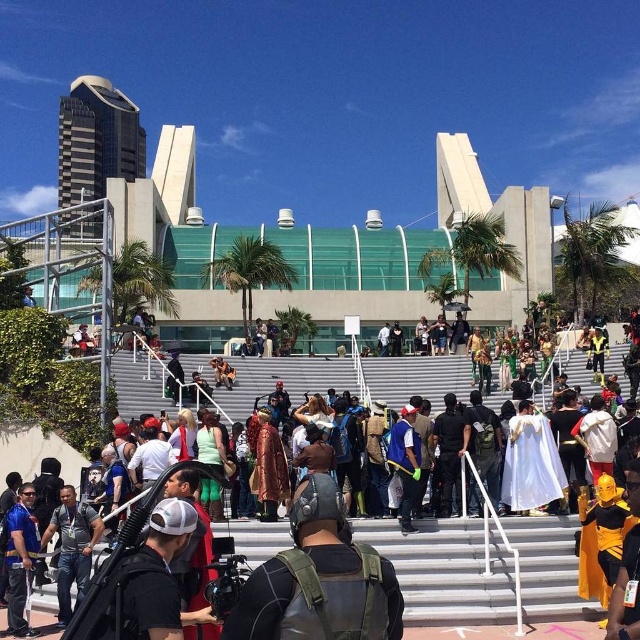
Who is more distant from viewer, (278, 371) or (316, 502)?

The point (278, 371) is behind.

What do you see at coordinates (445, 570) in the screenshot? I see `white cotton shirt at center` at bounding box center [445, 570].

This screenshot has width=640, height=640. Find the location of `white cotton shirt at center`. white cotton shirt at center is located at coordinates (445, 570).